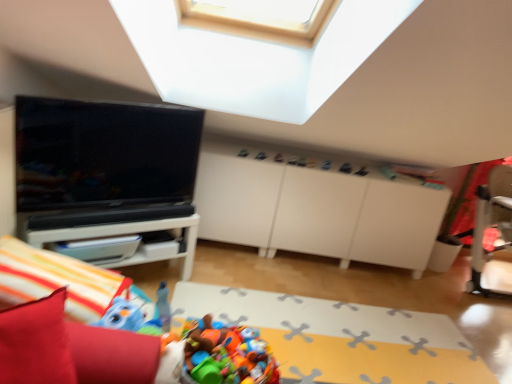
At what (x,y) coordinates should I click in order to perform the action: click on vacant area that is situated to the right of matte black toy at upper center, the 3th toy when ordered from left to right. Please return your answer as a coordinate pair (x, y). Looking at the image, I should click on (369, 168).